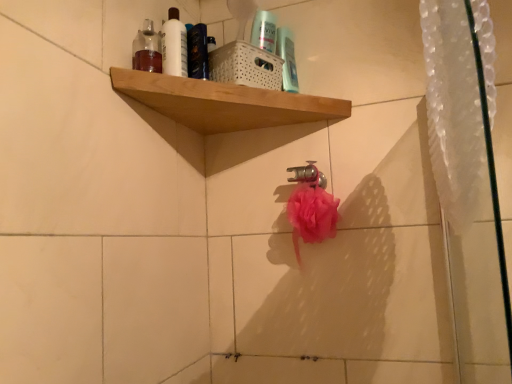
This screenshot has width=512, height=384. Find the location of `wooden shelf at upper center`. wooden shelf at upper center is located at coordinates (223, 102).

The image size is (512, 384). Describe the element at coordinates (147, 49) in the screenshot. I see `translucent plastic bottle at upper left` at that location.

Find the location of a particular element. The image size is (512, 384). clear plastic shower curtain at right is located at coordinates (453, 110).

What are the coordinates of `wooden shelf at upper center` in the screenshot? It's located at (223, 102).

Is wooden shelf at upper center at the left side of white glossy bottle at upper center?

In fact, wooden shelf at upper center is to the right of white glossy bottle at upper center.

From a real-world perspective, is wooden shelf at upper center above or below white glossy bottle at upper center?

wooden shelf at upper center is situated lower than white glossy bottle at upper center in the real world.

Which point is more forward, (219, 122) or (162, 62)?

The point (162, 62) is closer to the camera.

Is wooden shelf at upper center situated inside white glossy bottle at upper center or outside?

wooden shelf at upper center exists outside the volume of white glossy bottle at upper center.

Does point (182, 70) come in front of point (442, 45)?

No.

Which object is positioned more to the right, white glossy bottle at upper center or clear plastic shower curtain at right?

clear plastic shower curtain at right is more to the right.

Can you confirm if white glossy bottle at upper center is taller than clear plastic shower curtain at right?

In fact, white glossy bottle at upper center may be shorter than clear plastic shower curtain at right.

Is white glossy bottle at upper center thinner than clear plastic shower curtain at right?

Yes, white glossy bottle at upper center is thinner than clear plastic shower curtain at right.

Considering the positions of points (183, 26) and (151, 40), is point (183, 26) farther from camera compared to point (151, 40)?

Yes.

From a real-world perspective, is white glossy bottle at upper center over translucent plastic bottle at upper left?

Correct, in the physical world, white glossy bottle at upper center is higher than translucent plastic bottle at upper left.

Between white glossy bottle at upper center and translucent plastic bottle at upper left, which one has smaller size?

With smaller size is white glossy bottle at upper center.

Is white glossy bottle at upper center closer to the viewer compared to translucent plastic bottle at upper left?

No.

Considering the positions of objects translucent plastic bottle at upper left and white glossy bottle at upper center in the image provided, who is more to the left, translucent plastic bottle at upper left or white glossy bottle at upper center?

Positioned to the left is translucent plastic bottle at upper left.

How different are the orientations of translucent plastic bottle at upper left and white glossy bottle at upper center in degrees?

There is a 16.1-degree angle between the facing directions of translucent plastic bottle at upper left and white glossy bottle at upper center.

Between translucent plastic bottle at upper left and white glossy bottle at upper center, which one has larger size?

With larger size is translucent plastic bottle at upper left.

Considering the points (140, 34) and (177, 73), which point is in front, point (140, 34) or point (177, 73)?

Positioned in front is point (140, 34).

Is clear plastic shower curtain at right to the left or to the right of white glossy bottle at upper center in the image?

In the image, clear plastic shower curtain at right appears on the right side of white glossy bottle at upper center.

Between point (446, 185) and point (185, 66), which one is positioned behind?

Point (185, 66)

Identify the location of mouthwash located behind the clear plastic shower curtain at right. (174, 45).

From a real-world perspective, is clear plastic shower curtain at right physically below white glossy bottle at upper center?

Yes, from a real-world perspective, clear plastic shower curtain at right is beneath white glossy bottle at upper center.

Between translucent plastic bottle at upper left and clear plastic shower curtain at right, which one is positioned behind?

translucent plastic bottle at upper left is further away from the camera.

Would you say translucent plastic bottle at upper left is inside or outside clear plastic shower curtain at right?

The correct answer is: outside.

From a real-world perspective, who is located lower, translucent plastic bottle at upper left or clear plastic shower curtain at right?

clear plastic shower curtain at right is physically lower.

Does point (156, 66) come in front of point (473, 187)?

No, it is behind (473, 187).

Is clear plastic shower curtain at right at the back of wooden shelf at upper center?

No, wooden shelf at upper center is not facing away from clear plastic shower curtain at right.

Is wooden shelf at upper center smaller than clear plastic shower curtain at right?

Incorrect, wooden shelf at upper center is not smaller in size than clear plastic shower curtain at right.

Does wooden shelf at upper center lie behind clear plastic shower curtain at right?

Yes, it is behind clear plastic shower curtain at right.

From a real-world perspective, is wooden shelf at upper center physically above clear plastic shower curtain at right?

Yes, from a real-world perspective, wooden shelf at upper center is over clear plastic shower curtain at right

What are the coordinates of `shelf located underneath the white glossy bottle at upper center (from a real-world perspective)` in the screenshot? It's located at pos(223,102).

You are a GUI agent. You are given a task and a screenshot of the screen. Output one action in this format:
    pyautogui.click(x=<x>, y=<y>)
    Task: Click on the shower curtain below the white glossy bottle at upper center (from the image's perspective)
    This screenshot has height=384, width=512.
    Given the screenshot: What is the action you would take?
    pyautogui.click(x=453, y=110)

Considering their positions, is translucent plastic bottle at upper left positioned closer to wooden shelf at upper center than white glossy bottle at upper center?

white glossy bottle at upper center lies closer to wooden shelf at upper center than the other object.

Looking at the image, which one is located closer to translucent plastic bottle at upper left, wooden shelf at upper center or white glossy bottle at upper center?

white glossy bottle at upper center lies closer to translucent plastic bottle at upper left than the other object.

Based on their spatial positions, is clear plastic shower curtain at right or wooden shelf at upper center further from white glossy bottle at upper center?

Among the two, clear plastic shower curtain at right is located further to white glossy bottle at upper center.

Which object lies further to the anchor point translucent plastic bottle at upper left, wooden shelf at upper center or clear plastic shower curtain at right?

clear plastic shower curtain at right.

In the scene shown: Considering their positions, is clear plastic shower curtain at right positioned further to white glossy bottle at upper center than translucent plastic bottle at upper left?

clear plastic shower curtain at right is further to white glossy bottle at upper center.

Considering their positions, is wooden shelf at upper center positioned closer to white glossy bottle at upper center than clear plastic shower curtain at right?

Among the two, wooden shelf at upper center is located nearer to white glossy bottle at upper center.

Looking at the image, which one is located closer to clear plastic shower curtain at right, white glossy bottle at upper center or translucent plastic bottle at upper left?

The object closer to clear plastic shower curtain at right is white glossy bottle at upper center.

Based on their spatial positions, is wooden shelf at upper center or white glossy bottle at upper center closer to clear plastic shower curtain at right?

Based on the image, wooden shelf at upper center appears to be nearer to clear plastic shower curtain at right.

At what (x,y) coordinates should I click in order to perform the action: click on shelf between translucent plastic bottle at upper left and clear plastic shower curtain at right. Please return your answer as a coordinate pair (x, y). The width and height of the screenshot is (512, 384). Looking at the image, I should click on (223, 102).

I want to click on toiletry located between clear plastic shower curtain at right and white glossy bottle at upper center in the depth direction, so click(147, 49).

The width and height of the screenshot is (512, 384). I want to click on toiletry between wooden shelf at upper center and white glossy bottle at upper center along the z-axis, so click(x=147, y=49).

The width and height of the screenshot is (512, 384). Identify the location of shelf between clear plastic shower curtain at right and white glossy bottle at upper center in the front-back direction. (223, 102).